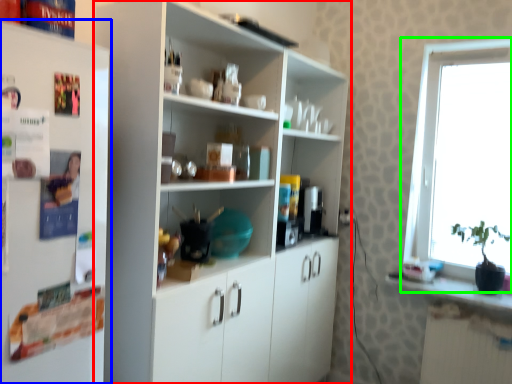
Question: Considering the real-world distances, which object is closest to cupboard (highlighted by a red box)? refrigerator (highlighted by a blue box) or window (highlighted by a green box).

Choices:
 (A) refrigerator
 (B) window

Answer: (A)